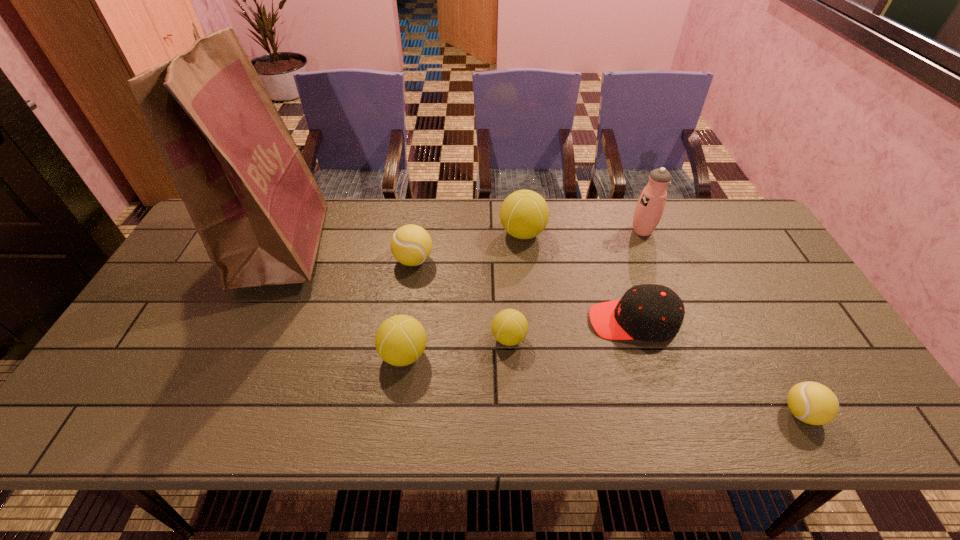
Locate an element on the screen. This screenshot has width=960, height=540. blank space that satisfies the following two spatial constraints: 1. on the back side of the third tallest object; 2. on the left side of the bigger yellow tennis ball is located at coordinates (418, 233).

At what (x,y) coordinates should I click in order to perform the action: click on vacant space that satisfies the following two spatial constraints: 1. on the back side of the rightmost tennis ball; 2. on the front-facing side of the cap. Please return your answer as a coordinate pair (x, y). Image resolution: width=960 pixels, height=540 pixels. Looking at the image, I should click on (752, 321).